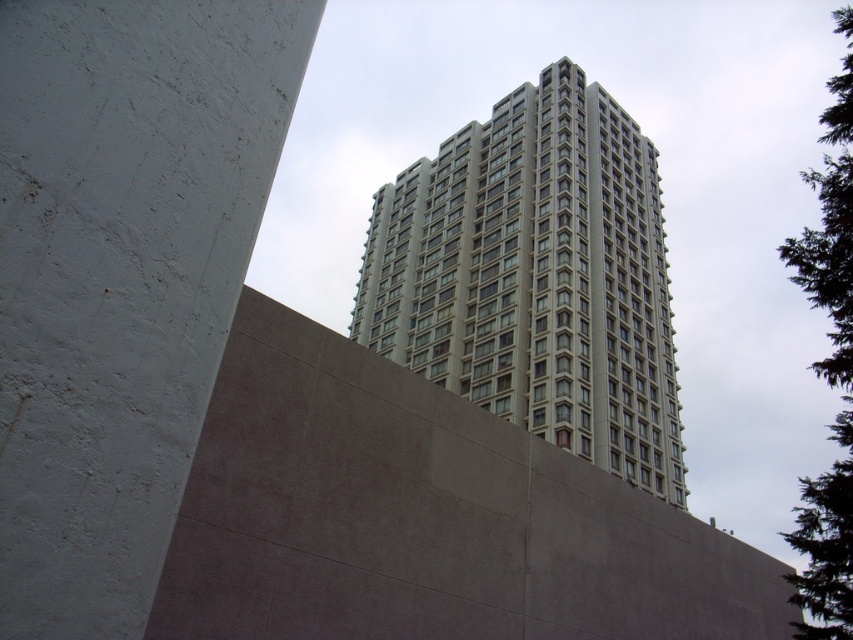
Between gray concrete building at upper center and green textured tree at upper right, which one is positioned higher?

Positioned higher is gray concrete building at upper center.

Can you confirm if gray concrete building at upper center is positioned below green textured tree at upper right?

No.

Is point (556, 440) closer to camera compared to point (849, 390)?

Yes, it is in front of point (849, 390).

Locate an element on the screen. The image size is (853, 640). gray concrete building at upper center is located at coordinates (537, 276).